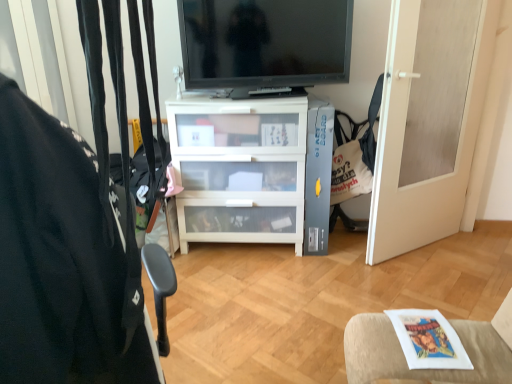
Question: Is black fabric chair at left positioned behind black glossy tv at upper center?

Choices:
 (A) yes
 (B) no

Answer: (B)

Question: Can you confirm if black fabric chair at left is taller than black glossy tv at upper center?

Choices:
 (A) yes
 (B) no

Answer: (A)

Question: Is black fabric chair at left shorter than black glossy tv at upper center?

Choices:
 (A) no
 (B) yes

Answer: (A)

Question: From the image's perspective, would you say black fabric chair at left is positioned over black glossy tv at upper center?

Choices:
 (A) yes
 (B) no

Answer: (B)

Question: Is black glossy tv at upper center a part of black fabric chair at left?

Choices:
 (A) yes
 (B) no

Answer: (B)

Question: Is black fabric chair at left completely or partially outside of black glossy tv at upper center?

Choices:
 (A) no
 (B) yes

Answer: (B)

Question: Can you confirm if white matte door at right is taller than black fabric chair at left?

Choices:
 (A) no
 (B) yes

Answer: (B)

Question: Does white matte door at right contain black fabric chair at left?

Choices:
 (A) yes
 (B) no

Answer: (B)

Question: From the image's perspective, is white matte door at right on black fabric chair at left?

Choices:
 (A) no
 (B) yes

Answer: (B)

Question: Is white matte door at right positioned before black fabric chair at left?

Choices:
 (A) no
 (B) yes

Answer: (A)

Question: From the image's perspective, is white matte door at right below black fabric chair at left?

Choices:
 (A) no
 (B) yes

Answer: (A)

Question: Is white matte door at right wider than black fabric chair at left?

Choices:
 (A) no
 (B) yes

Answer: (B)

Question: From the image's perspective, is black fabric chair at left above white fabric cushion at lower right?

Choices:
 (A) yes
 (B) no

Answer: (A)